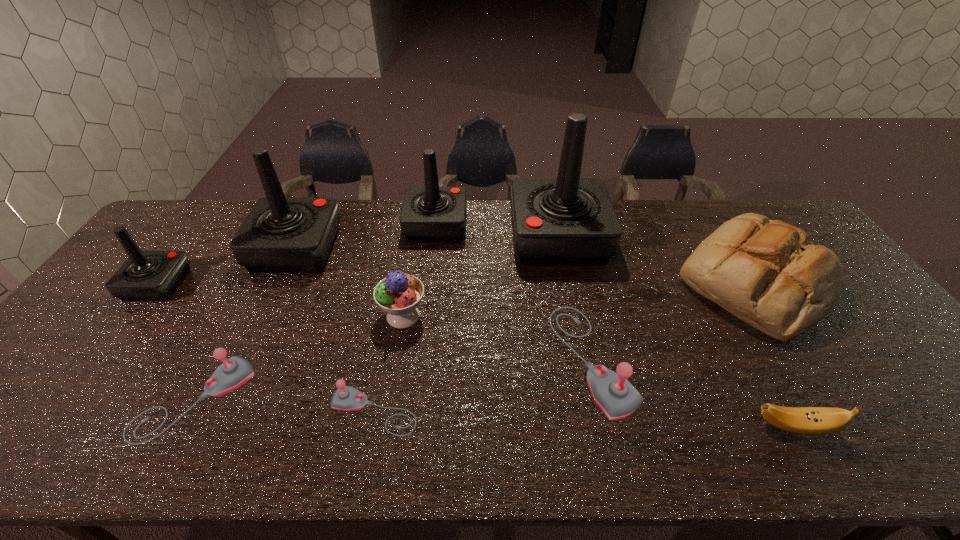
In order to click on the tallest joystick in this screenshot , I will do `click(568, 220)`.

I want to click on the rightmost red joystick, so click(568, 220).

Locate an element on the screen. the second tallest object is located at coordinates (280, 234).

Locate an element on the screen. The height and width of the screenshot is (540, 960). the second tallest joystick is located at coordinates (280, 234).

At what (x,y) coordinates should I click in order to perform the action: click on the third tallest object. Please return your answer as a coordinate pair (x, y). This screenshot has height=540, width=960. Looking at the image, I should click on (429, 214).

The height and width of the screenshot is (540, 960). Find the location of `the third red joystick from left to right`. the third red joystick from left to right is located at coordinates pos(429,214).

I want to click on the smallest red joystick, so click(x=146, y=275).

Image resolution: width=960 pixels, height=540 pixels. I want to click on the fourth tallest joystick, so click(146, 275).

The height and width of the screenshot is (540, 960). What are the coordinates of `bread` in the screenshot? It's located at (767, 273).

Find the location of a particular element. icecream is located at coordinates pos(399,294).